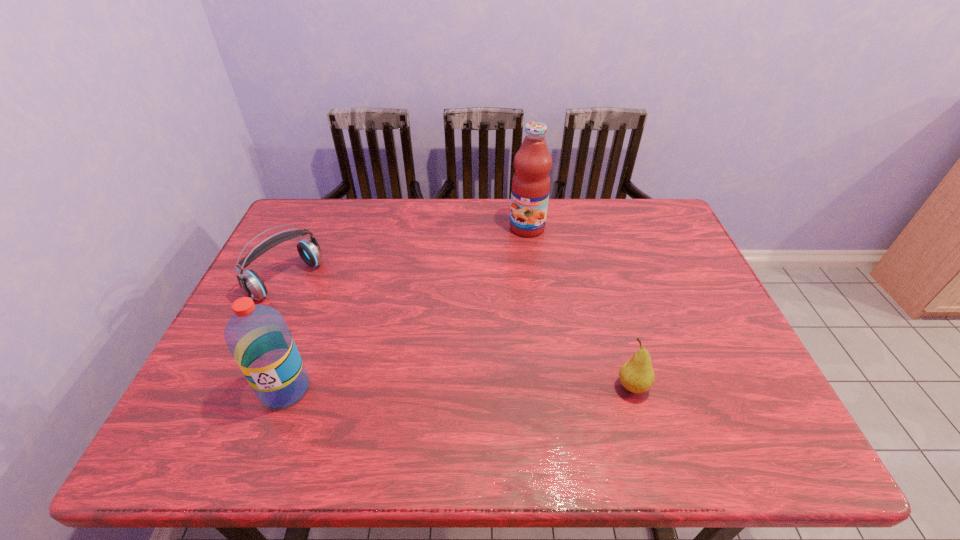
At what (x,y) coordinates should I click in order to perform the action: click on the third shortest object. Please return your answer as a coordinate pair (x, y). The height and width of the screenshot is (540, 960). Looking at the image, I should click on (257, 336).

Identify the location of pear. (636, 375).

Find the location of `the second farthest object`. the second farthest object is located at coordinates (251, 284).

The image size is (960, 540). What are the coordinates of `the third object from left to right` in the screenshot? It's located at (530, 190).

Image resolution: width=960 pixels, height=540 pixels. What are the coordinates of `the tallest object` in the screenshot? It's located at (530, 190).

This screenshot has height=540, width=960. In order to click on vacant space situated on the left of the rightmost object in this screenshot , I will do coord(563,387).

You are a GUI agent. You are given a task and a screenshot of the screen. Output one action in this format:
    pyautogui.click(x=<x>, y=<y>)
    Task: Click on the free space located on the ear cups of the headset
    This screenshot has height=540, width=960.
    Given the screenshot: What is the action you would take?
    pyautogui.click(x=335, y=320)

Where is `vacant space situated on the ear cups of the headset`? vacant space situated on the ear cups of the headset is located at coordinates (370, 347).

The height and width of the screenshot is (540, 960). What are the coordinates of `vacant space located on the ear cups of the headset` in the screenshot? It's located at (372, 349).

What are the coordinates of `blank space located on the front label of the fruit juice` in the screenshot? It's located at (500, 265).